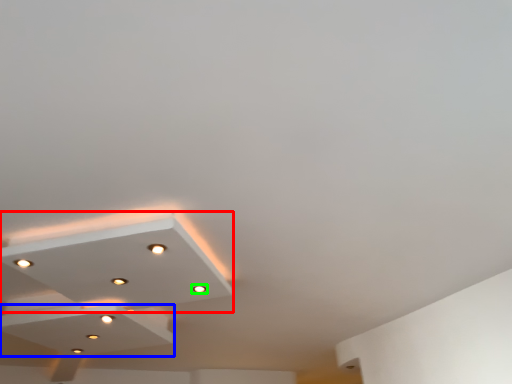
Question: Which object is positioned closest to lamp (highlighted by a red box)? Select from exhaust hood (highlighted by a blue box) and light (highlighted by a green box).

Choices:
 (A) exhaust hood
 (B) light

Answer: (A)